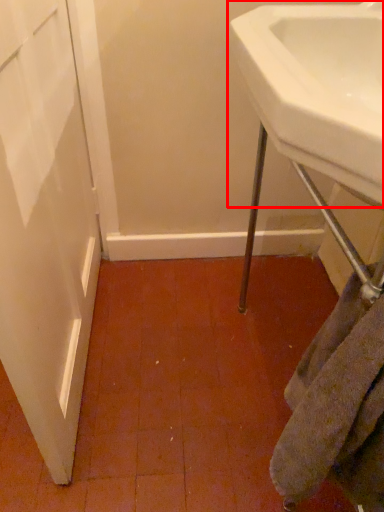
Question: From the image's perspective, where is sink (annotated by the red box) located relative to towel/napkin?

Choices:
 (A) above
 (B) below

Answer: (A)